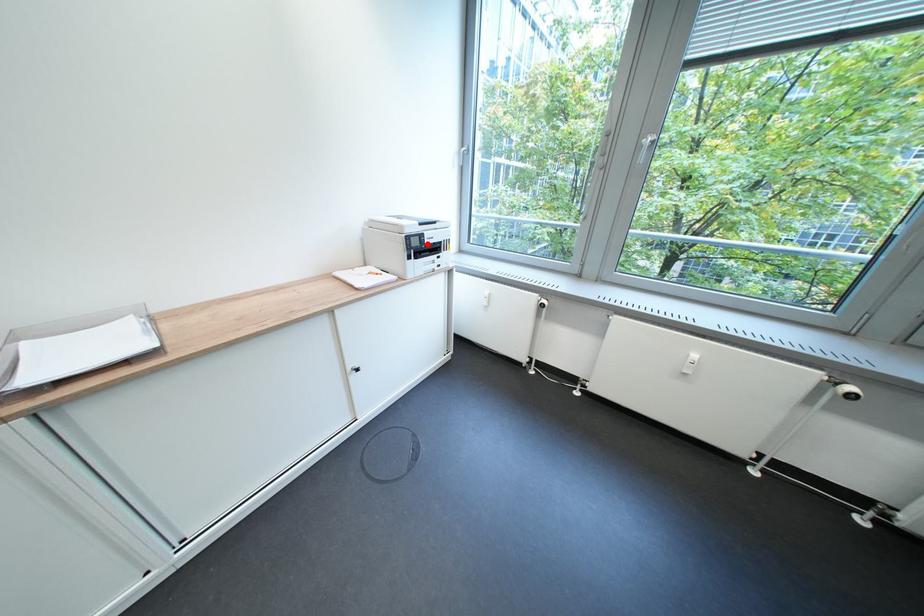
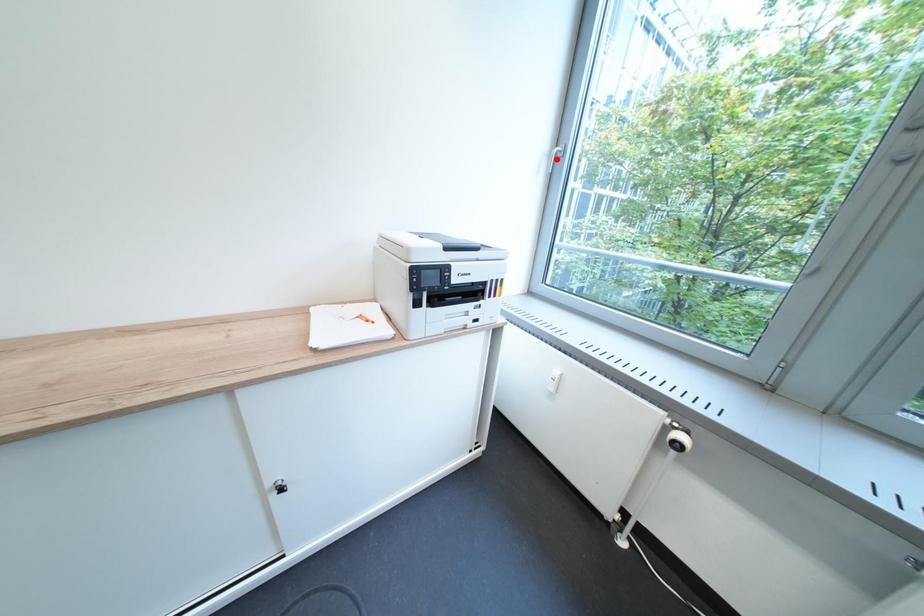
Consider the image. I am providing you with two images of the same scene from different viewpoints. A red point is marked on the first image and another point is marked on the second image. Are the points marked in image1 and image2 representing the same 3D position?

No